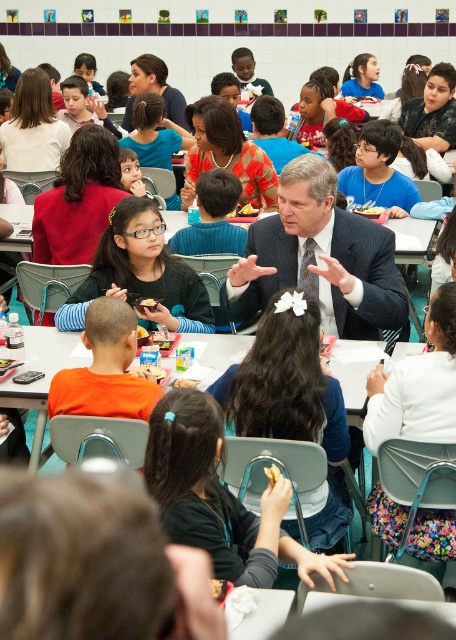
This screenshot has width=456, height=640. Describe the element at coordinates (41, 369) in the screenshot. I see `white plastic table at center` at that location.

Can you confirm if white plastic table at center is positioned to the right of white matte sandwich at center?

In fact, white plastic table at center is to the left of white matte sandwich at center.

From the picture: Who is more distant from viewer, (x=39, y=408) or (x=177, y=385)?

Point (x=39, y=408)

Where is `white plastic table at center`? The image size is (456, 640). white plastic table at center is located at coordinates (41, 369).

Is matte black sweater at center thinner than matte plastic snack at center?

No.

Can you confirm if matte black sweater at center is positioned above matte plastic snack at center?

Indeed, matte black sweater at center is positioned over matte plastic snack at center.

This screenshot has height=640, width=456. Identify the location of matte black sweater at center. click(x=140, y=273).

Which of these two, dark gray suit at center or golden crispy french fries at center, stands shorter?

Standing shorter between the two is golden crispy french fries at center.

Between point (335, 282) and point (241, 211), which one is positioned in front?

Point (335, 282) is more forward.

Is point (316, 264) positioned before point (258, 211)?

That is True.

At what (x,y) coordinates should I click in order to perform the action: click on dark gray suit at center. Please return your answer as a coordinate pair (x, y). Image resolution: width=456 pixels, height=640 pixels. Looking at the image, I should click on (321, 259).